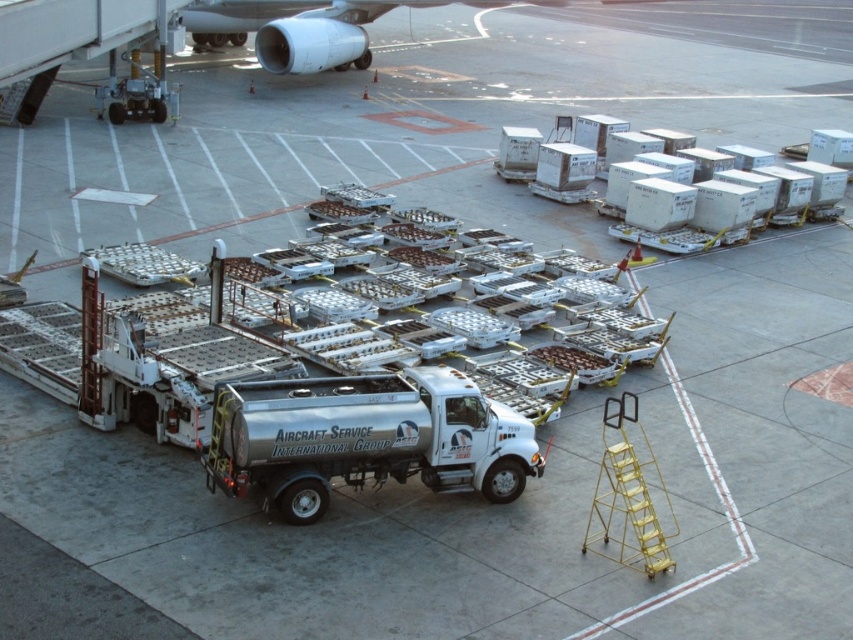
You are a ground crew member who needs to move the silver metallic truck at center to a different parking spot. However, you must ensure that the truck does not block the view of the metallic silver engine at upper center from the control tower. Based on their current positions, can you move the truck without obstructing the engine?

The silver metallic truck at center is currently in front of the metallic silver engine at upper center. Moving it would require positioning it so it no longer blocks the engine from the control tower. Since the truck is in front, moving it sideways or backward could allow the engine to remain visible.

You are a drone operator tasked with guiding a drone to capture aerial footage of the silver metallic truck at center. The drone is currently at the origin point of the coordinate system. What are the coordinates you should input to direct the drone to the truck?

The coordinates to direct the drone to the silver metallic truck at center are 0.684 on the x axis and 0.429 on the y axis.

You are standing at the origin point of the tarmac, which is at coordinate point 0,0. You see the silver metallic truck at center represented by point (364, 436). If you want to walk directly towards the truck, which direction should you go?

You should head towards the northeast direction since the truck is located at point (364, 436), which is northeast of the origin point 0,0.